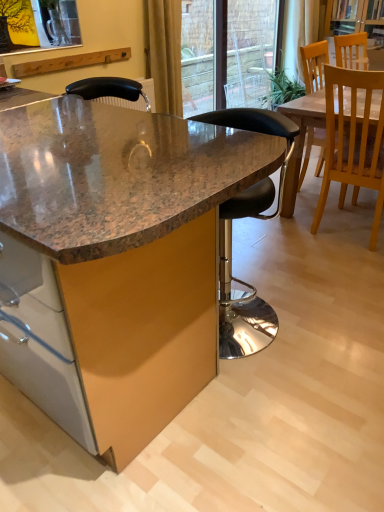
Question: Looking at their shapes, would you say light wood chair at right, which appears as the second chair when viewed from the left, is wider or thinner than white sheer curtain at upper center, the second curtain when ordered from bottom to top?

Choices:
 (A) wide
 (B) thin

Answer: (A)

Question: From a real-world perspective, is light wood chair at right, the second chair in the right-to-left sequence, physically located above or below white sheer curtain at upper center, the first curtain when ordered from top to bottom?

Choices:
 (A) below
 (B) above

Answer: (A)

Question: Which of these objects is positioned closest to the transparent glass door at upper center?

Choices:
 (A) yellow fabric curtain at upper center, marked as the 2th curtain in a right-to-left arrangement
 (B) white sheer curtain at upper center, arranged as the 1th curtain when viewed from the back
 (C) granite table at center
 (D) black leather stool at center, positioned as the 3th chair in right-to-left order
 (E) light wood chair at right, which appears as the second chair when viewed from the left

Answer: (B)

Question: Considering the real-world distances, which object is closest to the wooden chair at upper right, which is the 1th chair from right to left?

Choices:
 (A) black leather stool at center, positioned as the 3th chair in right-to-left order
 (B) light wood chair at right, which appears as the second chair when viewed from the left
 (C) granite table at center
 (D) transparent glass door at upper center
 (E) yellow fabric curtain at upper center, the 1th curtain viewed from the left

Answer: (B)